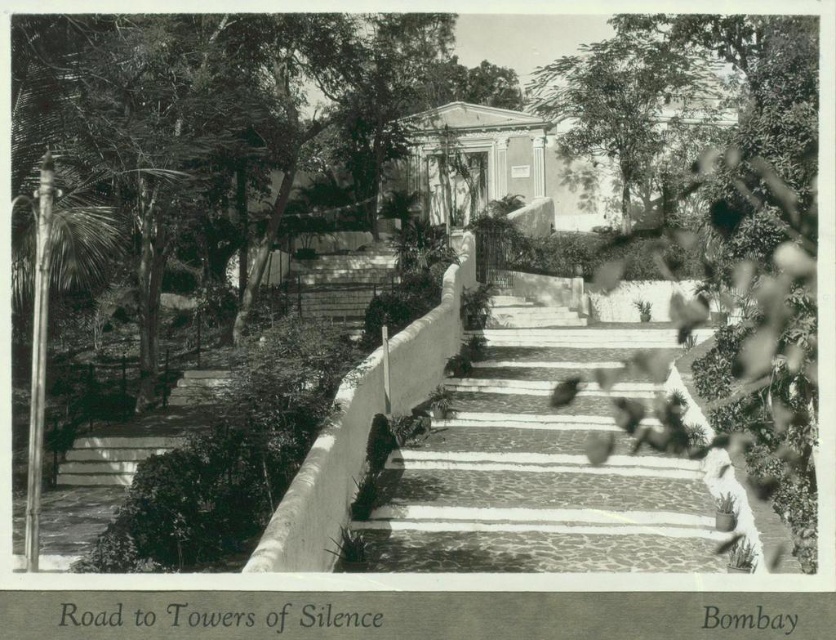
Question: Can you confirm if smooth green leafy tree at center is wider than marble stone steps at center?

Choices:
 (A) yes
 (B) no

Answer: (A)

Question: Does smooth green leafy tree at center appear under marble stone steps at center?

Choices:
 (A) yes
 (B) no

Answer: (B)

Question: Is smooth green leafy tree at center to the left of marble stone steps at center from the viewer's perspective?

Choices:
 (A) yes
 (B) no

Answer: (A)

Question: Which of the following is the farthest from the observer?

Choices:
 (A) (14, 92)
 (B) (432, 500)

Answer: (B)